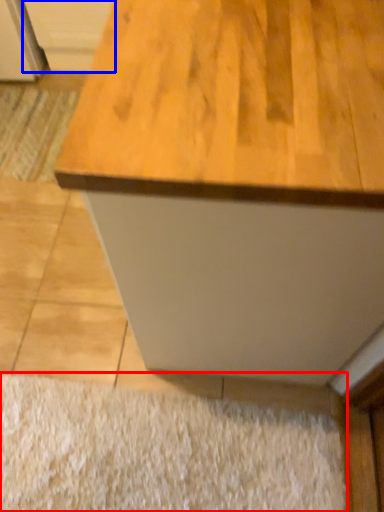
Question: Which of the following is the closest to the observer, doormat (highlighted by a red box) or cabinetry (highlighted by a blue box)?

Choices:
 (A) doormat
 (B) cabinetry

Answer: (A)